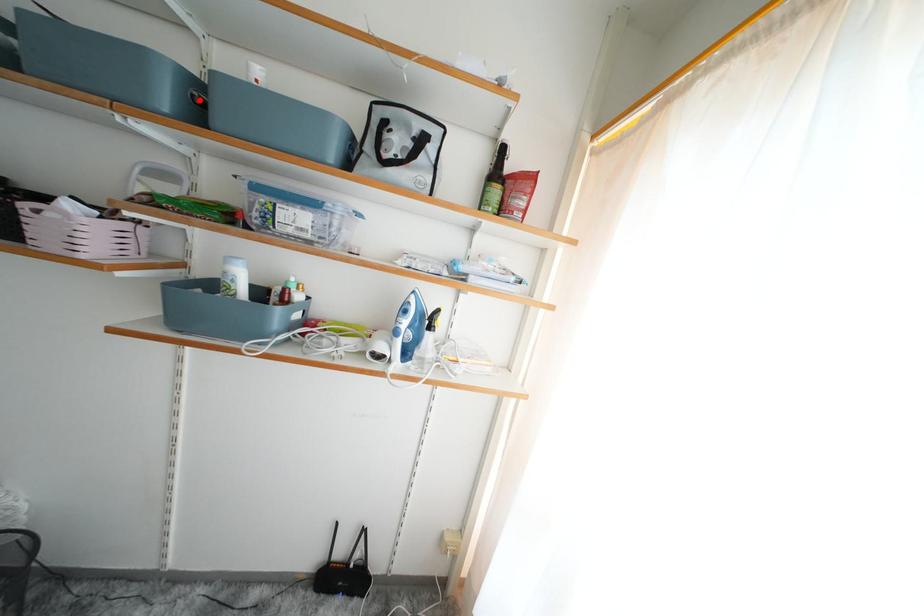
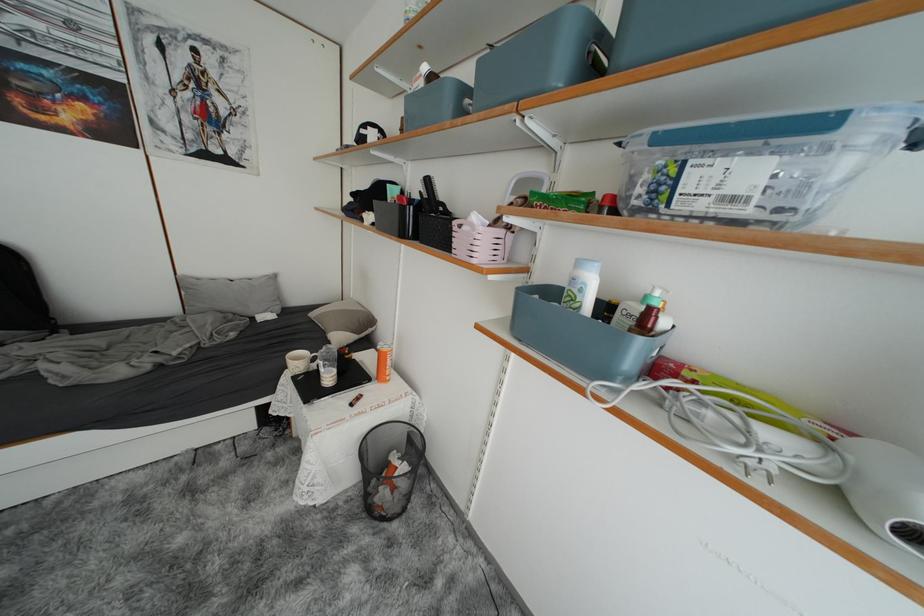
Locate, in the second image, the point that corresponds to the highlighted location in the first image.

(596, 55)